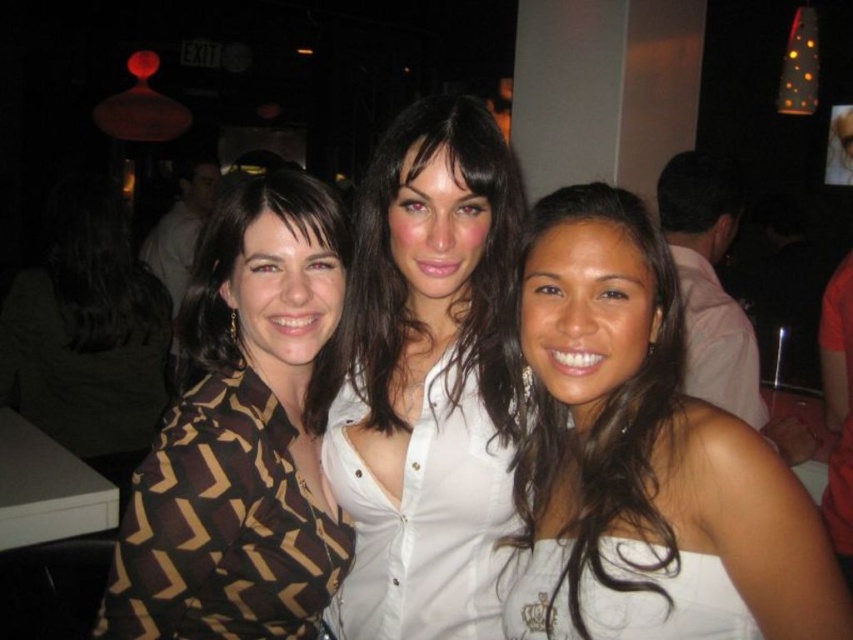
You are a photographer adjusting your camera settings to focus on two specific points in the image. The first point is at coordinates point [392,323] and the second point is at point [692,211]. Which point should you focus on first if you want to ensure both points are in focus?

You should focus on point [392,323] first because it is closer to the camera than point [692,211], ensuring both points will be in focus when adjusting the depth of field.

You are a photographer at the event and want to ensure that both the white satin dress at center and the white satin blouse at center are in focus. Given that your camera has a depth of field that can cover 8 inches, will both items be in focus?

The distance between the white satin dress at center and the white satin blouse at center is 7.99 inches, which is just under the camera lens depth of field of 8 inches. Therefore, both items will be in focus.